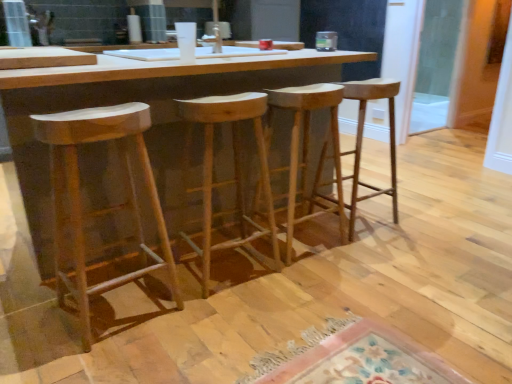
I want to click on free space on the front side of natural wood stool at left, the 1th stool from the left, so click(x=100, y=359).